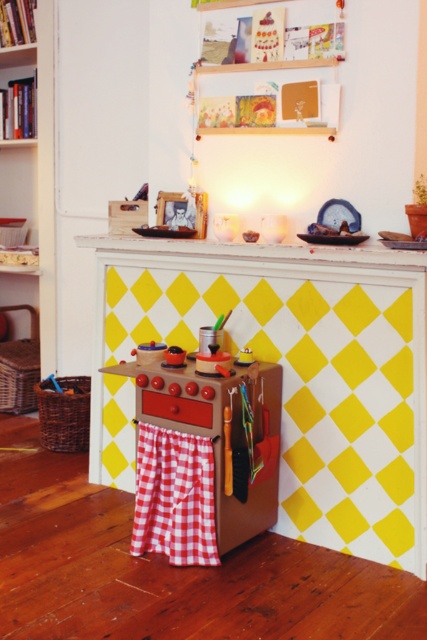
Question: Does wooden bookshelf at left appear under red checkered fabric at lower center?

Choices:
 (A) no
 (B) yes

Answer: (A)

Question: Is wooden bookshelf at left thinner than wooden toy stove at center?

Choices:
 (A) no
 (B) yes

Answer: (B)

Question: Which point is closer to the camera?

Choices:
 (A) wooden toy stove at center
 (B) red checkered fabric at lower center
 (C) wooden bookshelf at left

Answer: (A)

Question: Considering the real-world distances, which object is closest to the wooden bookshelf at left?

Choices:
 (A) red checkered fabric at lower center
 (B) wooden toy stove at center

Answer: (B)

Question: Is wooden bookshelf at left wider than red checkered fabric at lower center?

Choices:
 (A) yes
 (B) no

Answer: (A)

Question: Which point is farther to the camera?

Choices:
 (A) (248, 529)
 (B) (195, 516)
 (C) (26, 49)

Answer: (C)